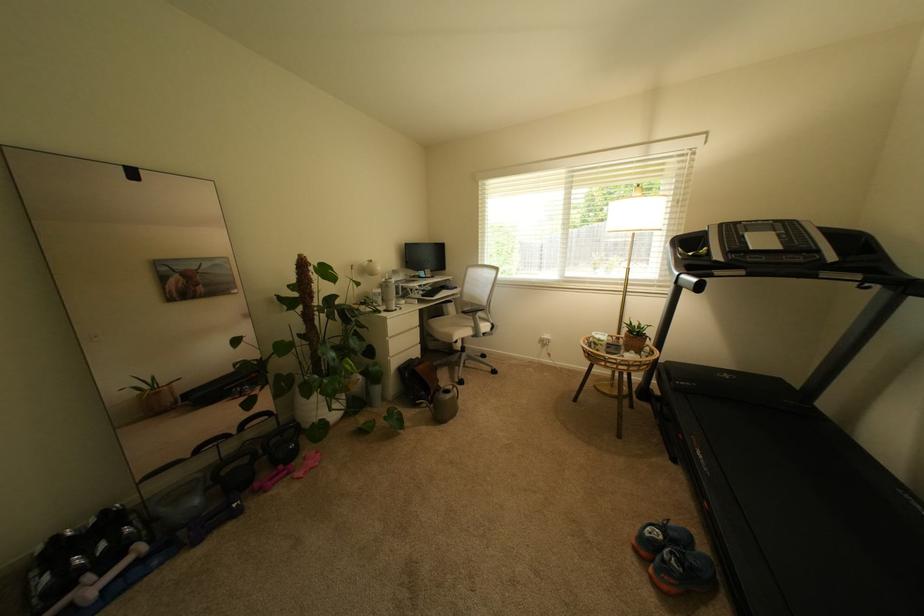
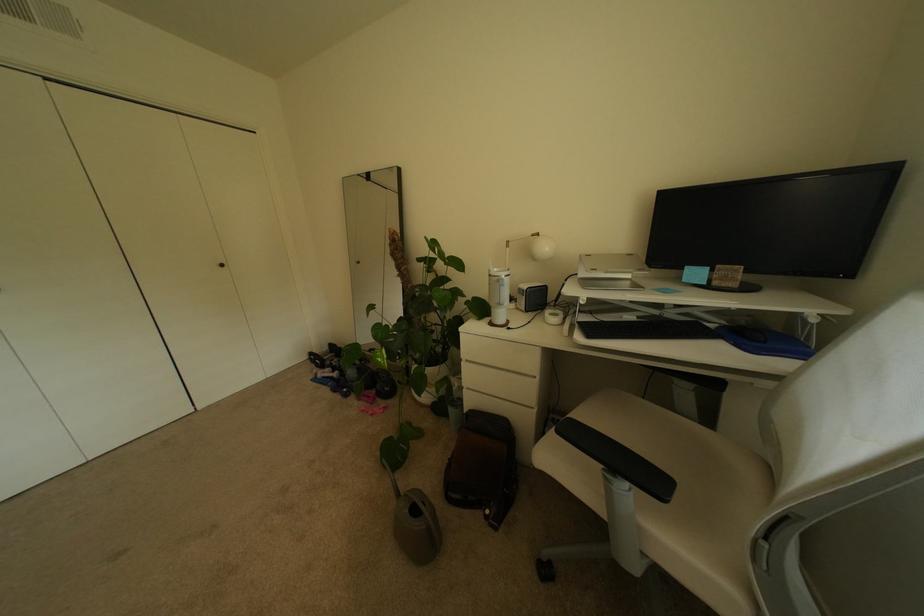
The point at (412, 283) is marked in the first image. Where is the corresponding point in the second image?

(637, 284)